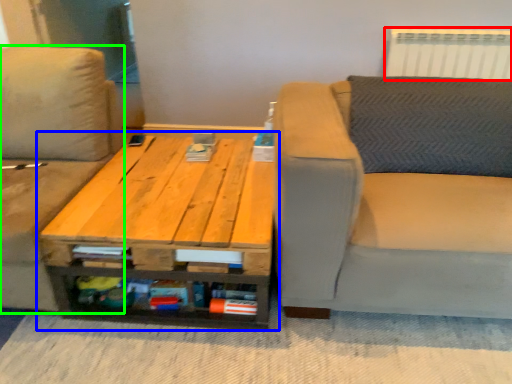
Question: Which object is the farthest from radiator (highlighted by a red box)? Choose among these: table (highlighted by a blue box) or studio couch (highlighted by a green box).

Choices:
 (A) table
 (B) studio couch

Answer: (B)